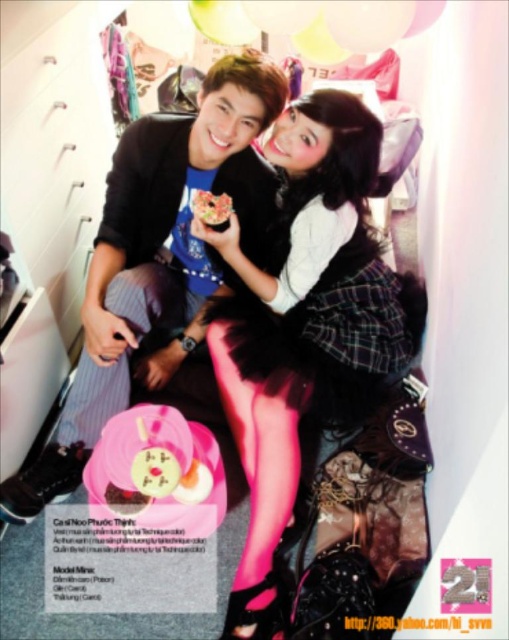
Question: Which object is farther from the camera taking this photo?

Choices:
 (A) smooth chocolate bar at center
 (B) plaid fabric skirt at center

Answer: (B)

Question: Is pink tulle skirt at center to the left of matte black sweater at center from the viewer's perspective?

Choices:
 (A) no
 (B) yes

Answer: (A)

Question: In this image, where is pink tulle skirt at center located relative to matte black sweater at center?

Choices:
 (A) right
 (B) left

Answer: (A)

Question: Observing the image, what is the correct spatial positioning of pink tulle skirt at center in reference to matte black sweater at center?

Choices:
 (A) below
 (B) above

Answer: (A)

Question: Which object is positioned farthest from the plaid fabric skirt at center?

Choices:
 (A) smooth chocolate bar at center
 (B) matte black sweater at center

Answer: (A)

Question: Which object appears farthest from the camera in this image?

Choices:
 (A) pink tulle skirt at center
 (B) smooth chocolate bar at center

Answer: (B)